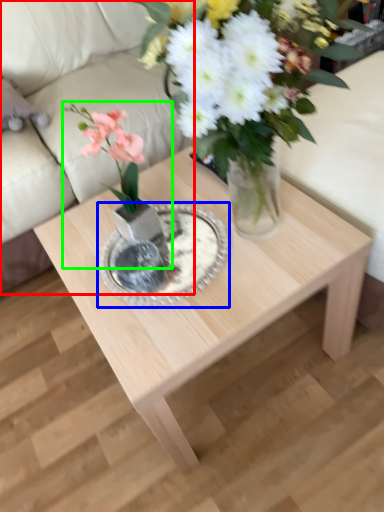
Question: Which is nearer to the couch (highlighted by a red box)? glass plate (highlighted by a blue box) or houseplant (highlighted by a green box).

Choices:
 (A) glass plate
 (B) houseplant

Answer: (A)